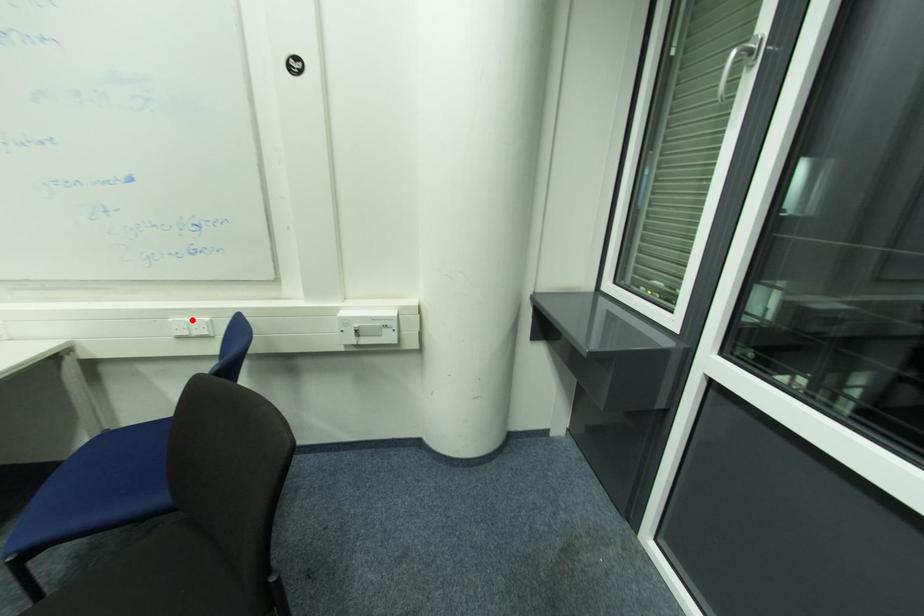
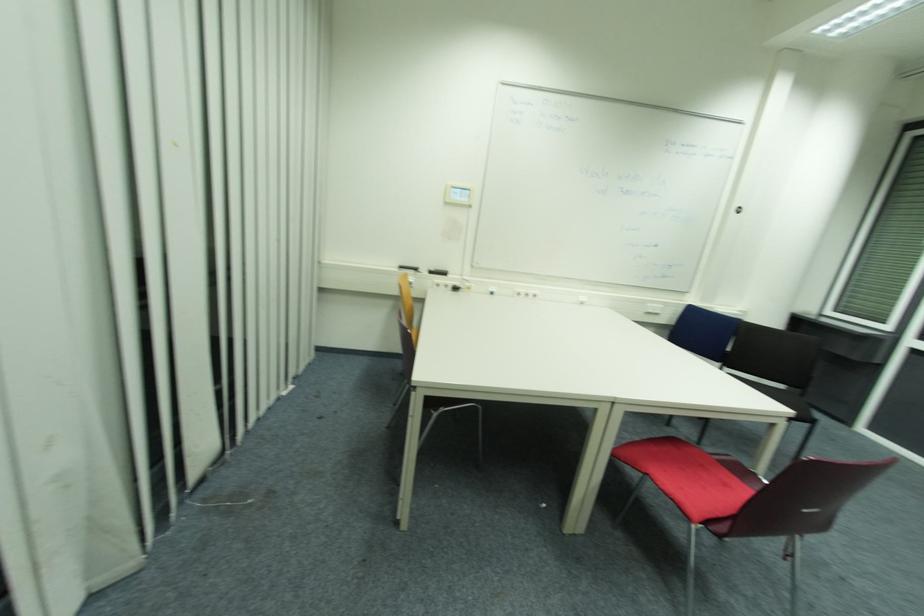
Question: A red point is marked in image1. In image2, is the corresponding 3D point closer to the camera or farther? Reply with the corresponding letter.

Choices:
 (A) The corresponding 3D point is closer.
 (B) The corresponding 3D point is farther.

Answer: (A)